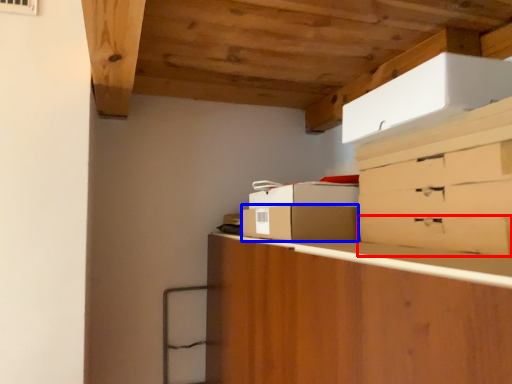
Question: Among these objects, which one is nearest to the camera, drawer (highlighted by a red box) or cardboard box (highlighted by a blue box)?

Choices:
 (A) drawer
 (B) cardboard box

Answer: (A)